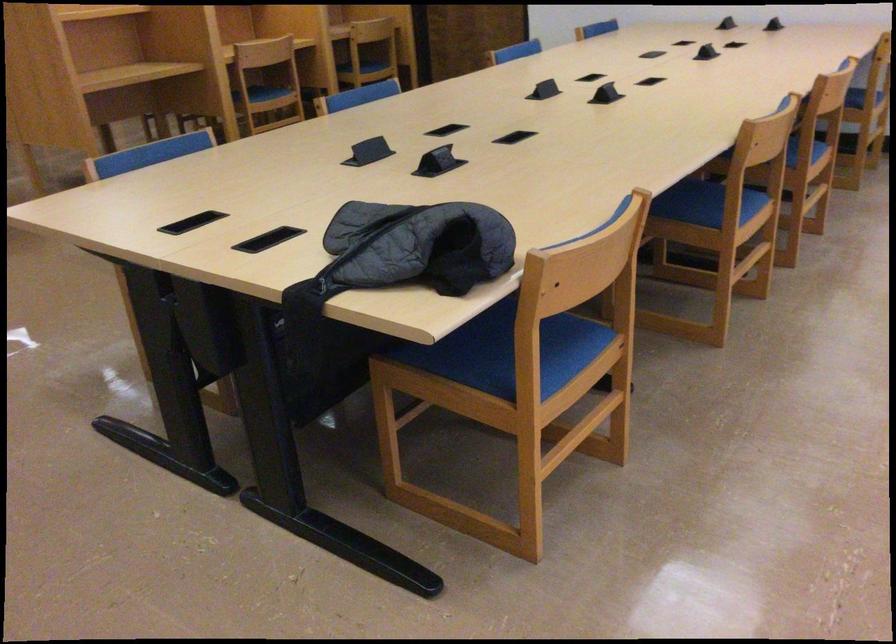
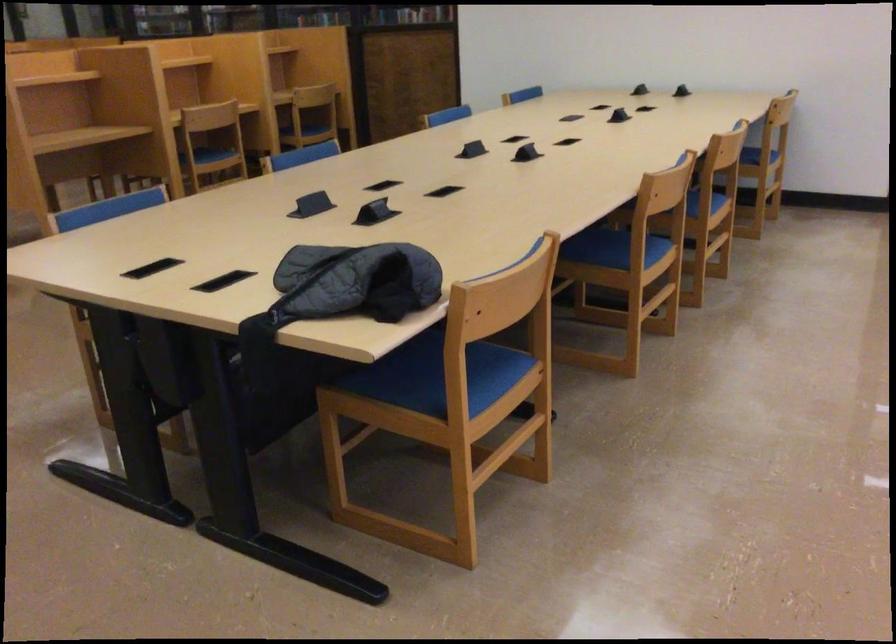
Question: What movement of the cameraman would produce the second image?

Choices:
 (A) Left
 (B) Right
 (C) Forward
 (D) Backward

Answer: (D)